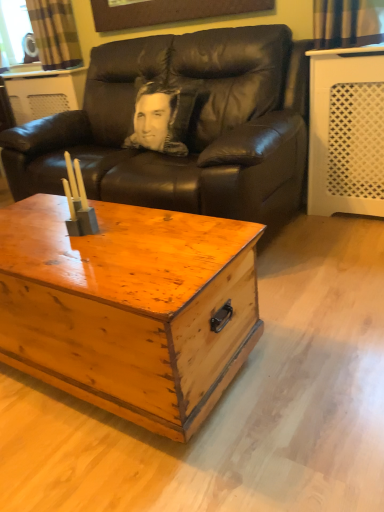
Locate an element on the screen. free space below plaid fabric curtain at upper left (from a real-world perspective) is located at coordinates (57, 72).